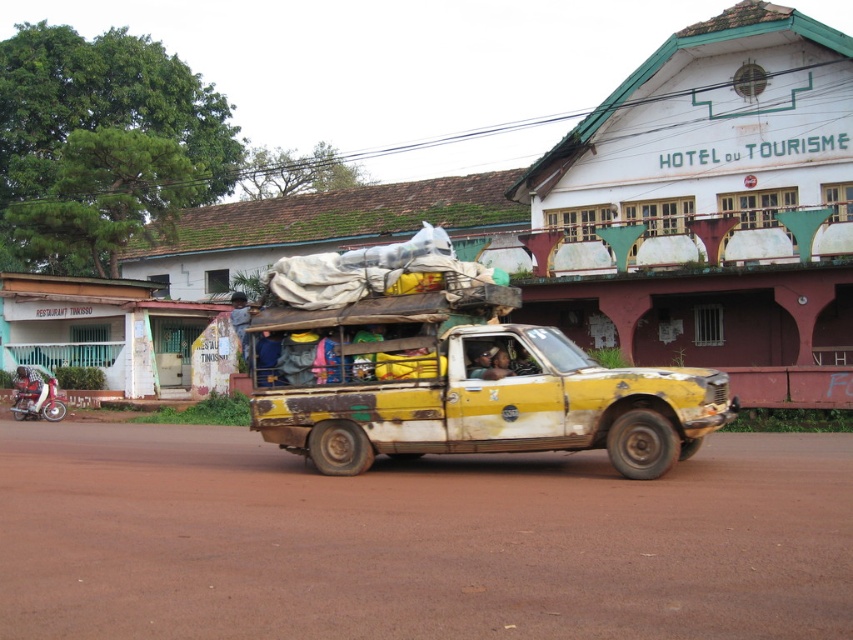
Is rusty yellow pickup truck at center bigger than brushed metal motorcycle at lower left?

Yes.

Between rusty yellow pickup truck at center and brushed metal motorcycle at lower left, which one has less height?

Standing shorter between the two is brushed metal motorcycle at lower left.

The width and height of the screenshot is (853, 640). In order to click on rusty yellow pickup truck at center in this screenshot , I will do `click(485, 401)`.

In order to click on rusty yellow pickup truck at center in this screenshot , I will do `click(485, 401)`.

Can you confirm if brown dirt track at center is smaller than brushed metal motorcycle at lower left?

No, brown dirt track at center is not smaller than brushed metal motorcycle at lower left.

Between brown dirt track at center and brushed metal motorcycle at lower left, which one appears on the left side from the viewer's perspective?

From the viewer's perspective, brushed metal motorcycle at lower left appears more on the left side.

Does point (579, 600) come in front of point (55, 387)?

Yes, it is in front of point (55, 387).

The image size is (853, 640). I want to click on brown dirt track at center, so click(416, 540).

Can you confirm if brown dirt track at center is wider than rusty yellow pickup truck at center?

Indeed, brown dirt track at center has a greater width compared to rusty yellow pickup truck at center.

Is brown dirt track at center below rusty yellow pickup truck at center?

Indeed, brown dirt track at center is positioned under rusty yellow pickup truck at center.

The image size is (853, 640). What are the coordinates of `brown dirt track at center` in the screenshot? It's located at (416, 540).

This screenshot has width=853, height=640. Find the location of `brown dirt track at center`. brown dirt track at center is located at coordinates (416, 540).